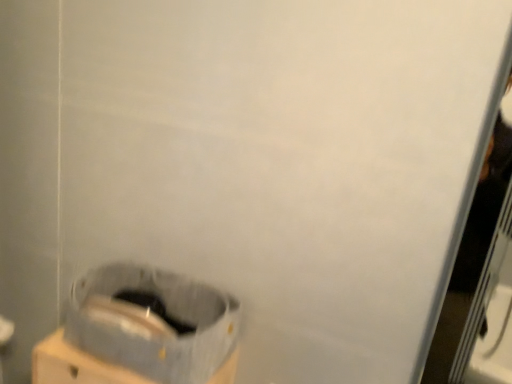
Question: Are gray fabric waste container at lower left and gray fabric bag at lower center located far from each other?

Choices:
 (A) yes
 (B) no

Answer: (B)

Question: Considering the relative sizes of gray fabric waste container at lower left and gray fabric bag at lower center in the image provided, is gray fabric waste container at lower left taller than gray fabric bag at lower center?

Choices:
 (A) no
 (B) yes

Answer: (A)

Question: Is gray fabric waste container at lower left behind gray fabric bag at lower center?

Choices:
 (A) no
 (B) yes

Answer: (A)

Question: Is gray fabric waste container at lower left in front of gray fabric bag at lower center?

Choices:
 (A) no
 (B) yes

Answer: (B)

Question: Is gray fabric waste container at lower left positioned with its back to gray fabric bag at lower center?

Choices:
 (A) yes
 (B) no

Answer: (B)

Question: Could you tell me if gray fabric waste container at lower left is facing gray fabric bag at lower center?

Choices:
 (A) no
 (B) yes

Answer: (A)

Question: Is gray fabric bag at lower center outside gray fabric waste container at lower left?

Choices:
 (A) yes
 (B) no

Answer: (A)

Question: Considering the relative sizes of gray fabric bag at lower center and gray fabric waste container at lower left in the image provided, is gray fabric bag at lower center smaller than gray fabric waste container at lower left?

Choices:
 (A) yes
 (B) no

Answer: (B)

Question: Does gray fabric bag at lower center have a greater width compared to gray fabric waste container at lower left?

Choices:
 (A) no
 (B) yes

Answer: (B)

Question: Is gray fabric bag at lower center positioned far away from gray fabric waste container at lower left?

Choices:
 (A) no
 (B) yes

Answer: (A)

Question: Is gray fabric bag at lower center oriented away from gray fabric waste container at lower left?

Choices:
 (A) yes
 (B) no

Answer: (B)

Question: Can you confirm if gray fabric bag at lower center is thinner than gray fabric waste container at lower left?

Choices:
 (A) no
 (B) yes

Answer: (A)

Question: Considering the positions of gray fabric waste container at lower left and gray fabric bag at lower center in the image, is gray fabric waste container at lower left taller or shorter than gray fabric bag at lower center?

Choices:
 (A) short
 (B) tall

Answer: (A)